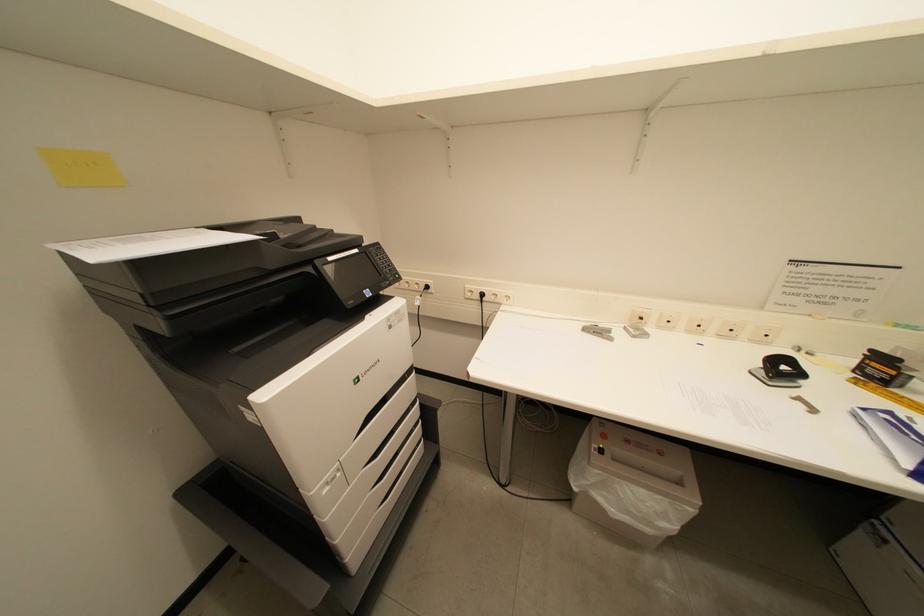
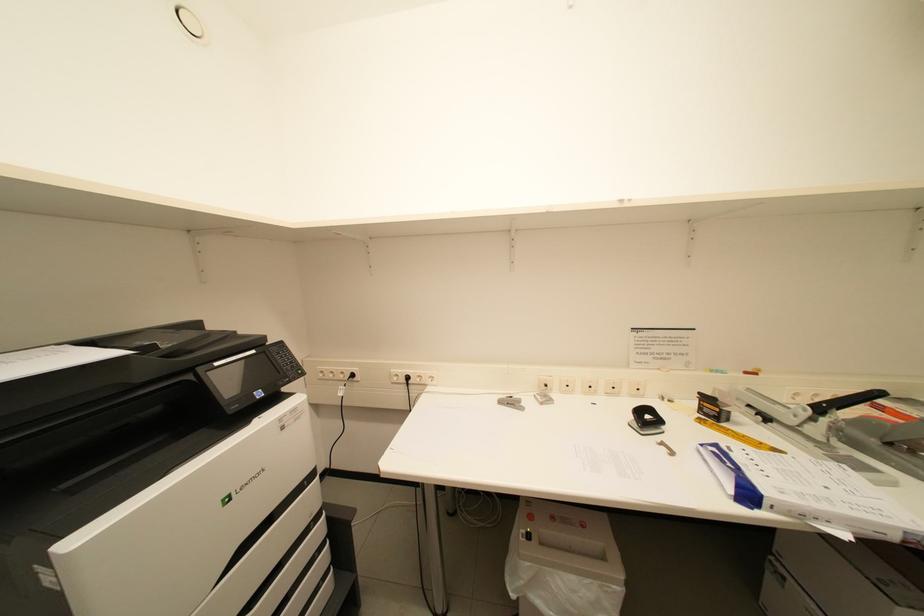
Which direction would the cameraman need to move to produce the second image?

The movement direction of the cameraman is right, backward.